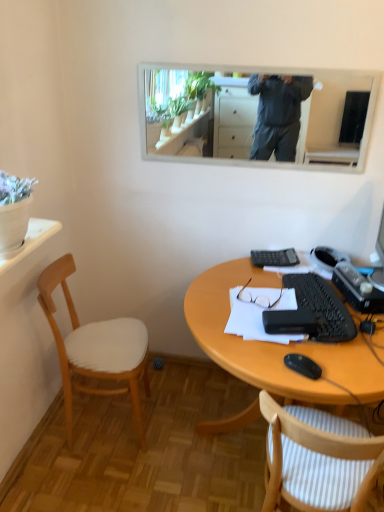
In order to click on vacant space behind black plastic mouse at lower right in this screenshot , I will do `click(306, 346)`.